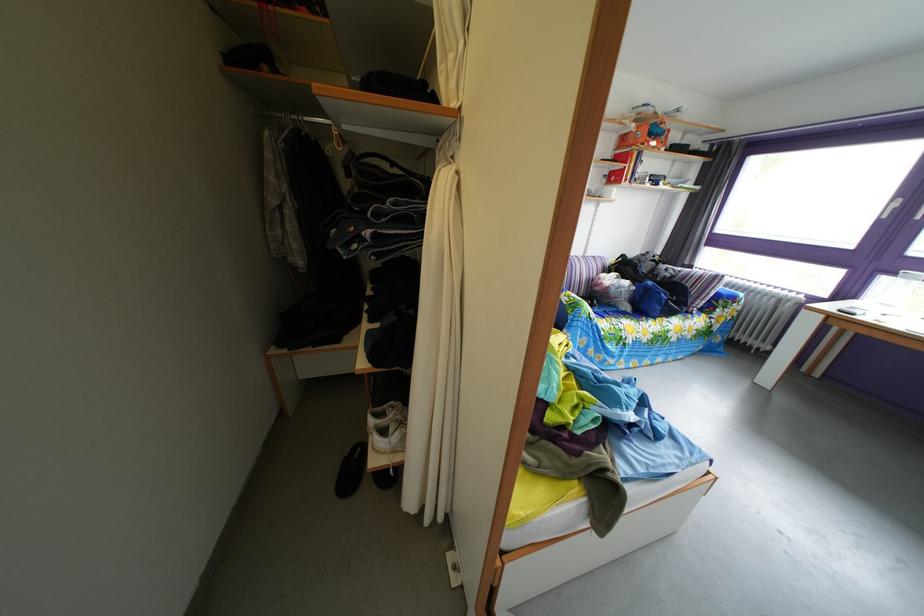
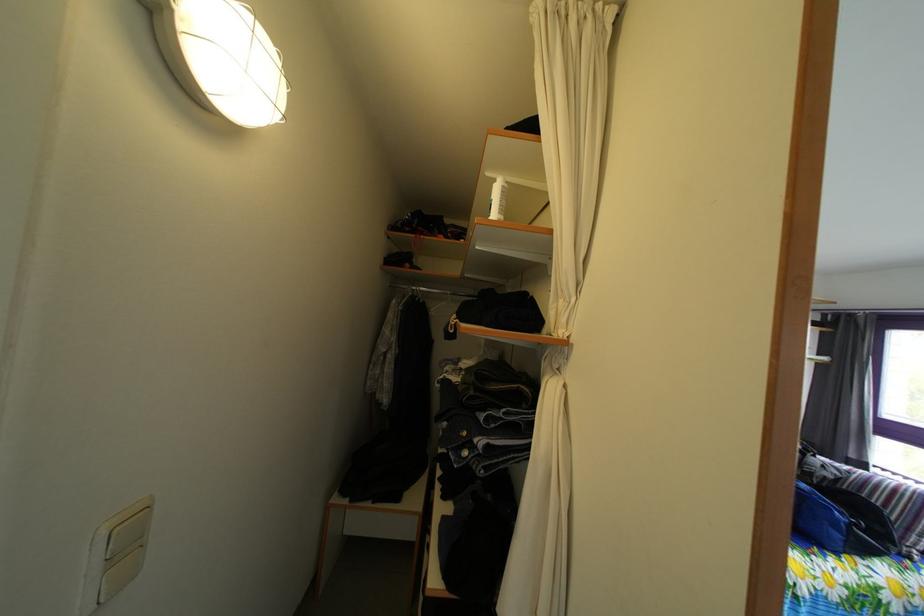
Where in the second image is the point corresponding to point 438,207 from the first image?

(545, 416)